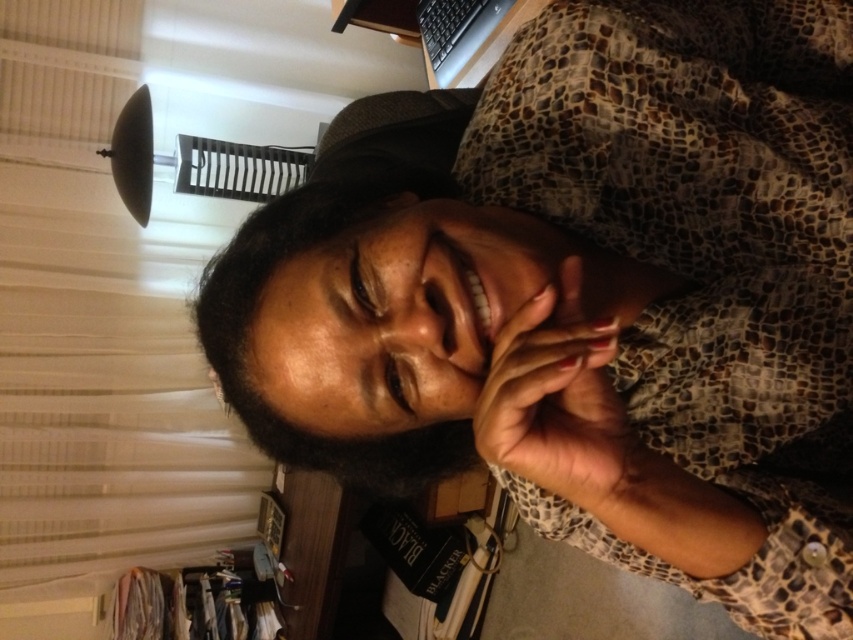
Question: Can you confirm if nail polish at center is wider than black plastic keyboard at upper right?

Choices:
 (A) no
 (B) yes

Answer: (A)

Question: Which point appears closest to the camera in this image?

Choices:
 (A) (508, 426)
 (B) (490, 28)
 (C) (363, 228)

Answer: (A)

Question: Which point appears farthest from the camera in this image?

Choices:
 (A) (590, 508)
 (B) (260, 349)
 (C) (434, 38)

Answer: (C)

Question: Considering the real-world distances, which object is closest to the smooth skin face at center?

Choices:
 (A) black plastic keyboard at upper right
 (B) nail polish at center

Answer: (B)

Question: Can you confirm if smooth skin face at center is thinner than nail polish at center?

Choices:
 (A) no
 (B) yes

Answer: (A)

Question: Where is nail polish at center located in relation to black plastic keyboard at upper right in the image?

Choices:
 (A) below
 (B) above

Answer: (A)